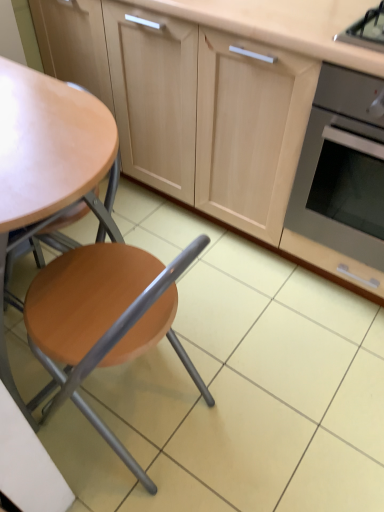
Question: Would you say matte wood chair at left is a long distance from matte wood cabinetry at center?

Choices:
 (A) no
 (B) yes

Answer: (A)

Question: Is matte wood chair at left smaller than matte wood cabinetry at center?

Choices:
 (A) yes
 (B) no

Answer: (A)

Question: From a real-world perspective, does matte wood chair at left sit lower than matte wood cabinetry at center?

Choices:
 (A) yes
 (B) no

Answer: (A)

Question: Considering the relative positions of matte wood chair at left and matte wood cabinetry at center in the image provided, is matte wood chair at left to the left of matte wood cabinetry at center from the viewer's perspective?

Choices:
 (A) no
 (B) yes

Answer: (B)

Question: From a real-world perspective, is matte wood chair at left over matte wood cabinetry at center?

Choices:
 (A) no
 (B) yes

Answer: (A)

Question: From the image's perspective, is matte wood chair at left on matte wood cabinetry at center?

Choices:
 (A) no
 (B) yes

Answer: (A)

Question: Can you confirm if stainless steel oven at right is positioned to the right of matte wood chair at left?

Choices:
 (A) no
 (B) yes

Answer: (B)

Question: Is stainless steel oven at right smaller than matte wood chair at left?

Choices:
 (A) yes
 (B) no

Answer: (A)

Question: Can you confirm if stainless steel oven at right is taller than matte wood chair at left?

Choices:
 (A) yes
 (B) no

Answer: (B)

Question: Is stainless steel oven at right surrounding matte wood chair at left?

Choices:
 (A) no
 (B) yes

Answer: (A)

Question: Does stainless steel oven at right turn towards matte wood chair at left?

Choices:
 (A) yes
 (B) no

Answer: (B)

Question: Is stainless steel oven at right not near matte wood chair at left?

Choices:
 (A) no
 (B) yes

Answer: (A)

Question: From the image's perspective, is matte wood cabinetry at center on stainless steel oven at right?

Choices:
 (A) yes
 (B) no

Answer: (A)